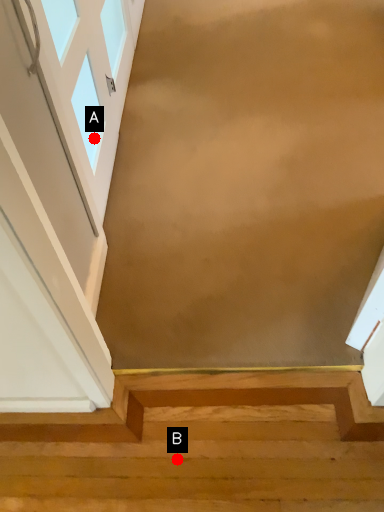
Question: Two points are circled on the image, labeled by A and B beside each circle. Which point appears closest to the camera in this image?

Choices:
 (A) A is closer
 (B) B is closer

Answer: (B)